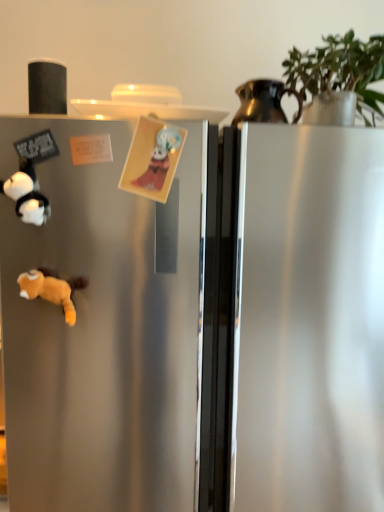
Question: Is fluffy orange stuffed animal at lower left to the left or to the right of green matte plant at upper right in the image?

Choices:
 (A) left
 (B) right

Answer: (A)

Question: From their relative heights in the image, would you say fluffy orange stuffed animal at lower left is taller or shorter than green matte plant at upper right?

Choices:
 (A) tall
 (B) short

Answer: (B)

Question: Which object is positioned closest to the fluffy orange stuffed animal at lower left?

Choices:
 (A) white plush panda at left, which ranks as the first toy in left-to-right order
 (B) metallic pitcher at upper right
 (C) matte paper card at center, placed as the 1th toy when sorted from right to left
 (D) green matte plant at upper right

Answer: (A)

Question: Considering the real-world distances, which object is closest to the fluffy orange stuffed animal at lower left?

Choices:
 (A) green matte plant at upper right
 (B) matte paper card at center, placed as the 2th toy when sorted from left to right
 (C) white plush panda at left, marked as the second toy in a right-to-left arrangement
 (D) metallic pitcher at upper right

Answer: (C)